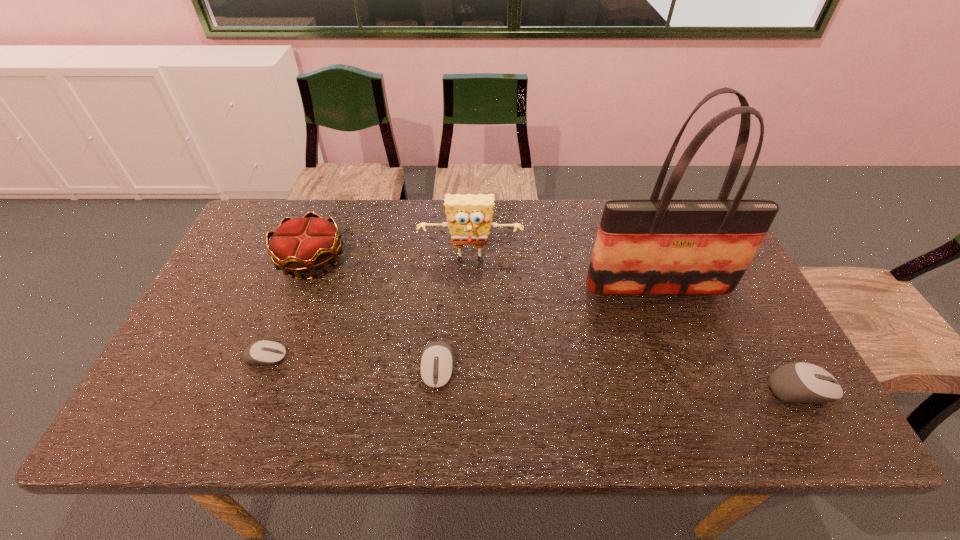
This screenshot has width=960, height=540. Identify the location of the shortest object. (263, 353).

At what (x,y) coordinates should I click in order to perform the action: click on the leftmost computer equipment. Please return your answer as a coordinate pair (x, y). This screenshot has height=540, width=960. Looking at the image, I should click on (263, 353).

Locate an element on the screen. The width and height of the screenshot is (960, 540). the second computer equipment from right to left is located at coordinates (436, 366).

Identify the location of the second tallest computer equipment. The width and height of the screenshot is (960, 540). (436, 366).

Where is `the fourth tallest object`? The width and height of the screenshot is (960, 540). the fourth tallest object is located at coordinates (800, 382).

This screenshot has width=960, height=540. I want to click on the rightmost computer equipment, so click(800, 382).

Locate an element on the screen. This screenshot has height=540, width=960. the fourth shortest object is located at coordinates (301, 245).

What are the coordinates of `the tallest object` in the screenshot? It's located at (666, 246).

Locate an element on the screen. sponge is located at coordinates (469, 217).

In order to click on vacant area situated on the wheel side of the shortest computer equipment in this screenshot , I will do `click(320, 357)`.